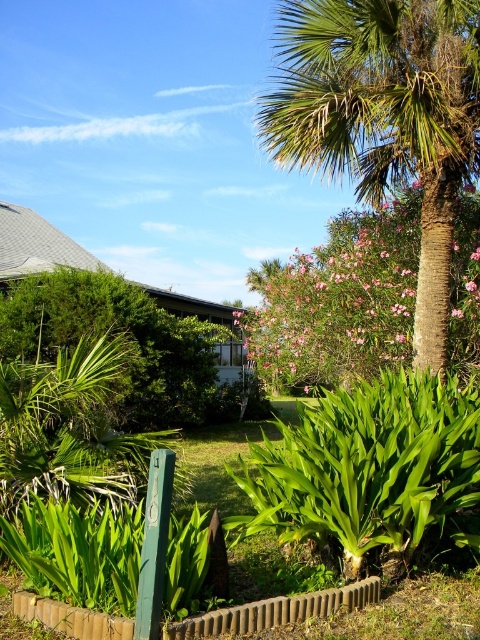
You are a gardener who wants to plant a new flower bed between the green leafy bush at center and the brick fence at lower center. Given their heights, which object might block sunlight to the new plants?

The green leafy bush at center is much taller than the brick fence at lower center, so it might block sunlight to the new plants.

You are standing in the garden and want to take a photo of both point (298,150) and point (128,394). Which point should you focus on first to ensure both are in focus?

You should focus on point (298,150) first because it is closer to the camera than point (128,394), ensuring both points are within the depth of field.

You are standing in the garden and want to place a small statue exactly at the center of the green leafy bush at center. Where should you place it?

You should place the small statue at point (119, 332) since that is the location of the green leafy bush at center.